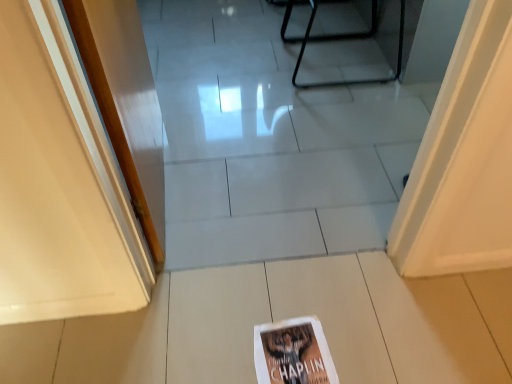
The width and height of the screenshot is (512, 384). In order to click on vacant space behind white paper book at center in this screenshot , I will do `click(287, 289)`.